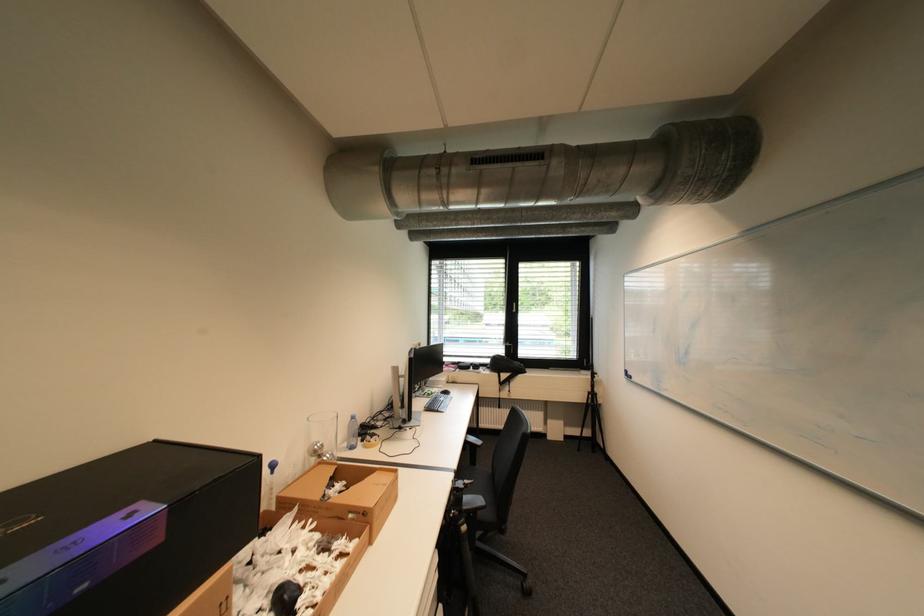
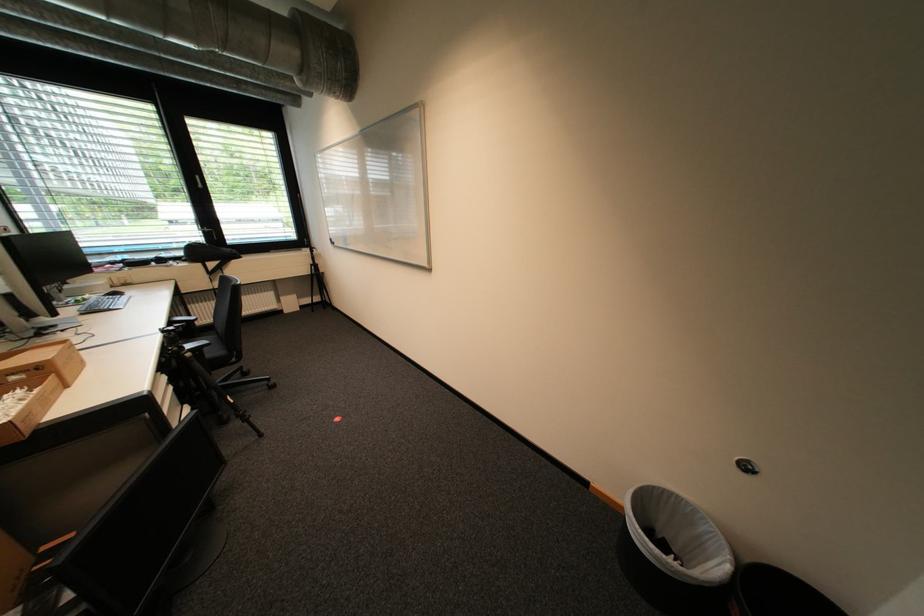
In the second image, find the point that corresponds to point 436,394 in the first image.

(86, 302)